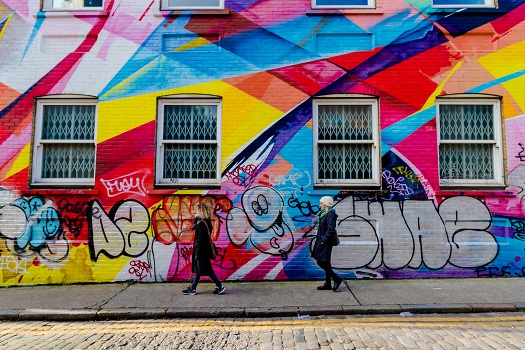
Where is `bottom window pane`? bottom window pane is located at coordinates (77, 165), (200, 150), (349, 152), (467, 162), (462, 1), (352, 1), (209, 1), (77, 0).